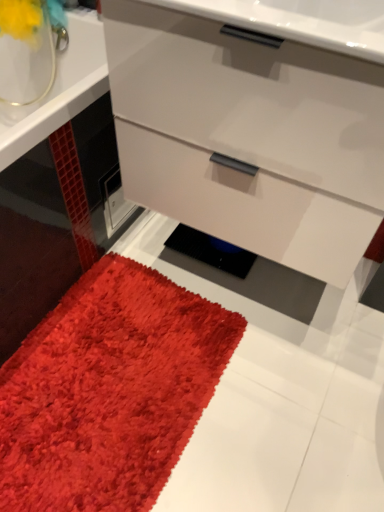
Question: Based on their sizes in the image, would you say matte white chest of drawers at center is bigger or smaller than matte yellow flower at upper left?

Choices:
 (A) small
 (B) big

Answer: (B)

Question: Would you say matte white chest of drawers at center is inside or outside matte yellow flower at upper left?

Choices:
 (A) inside
 (B) outside

Answer: (B)

Question: Which object is positioned farthest from the matte white chest of drawers at center?

Choices:
 (A) matte yellow flower at upper left
 (B) shaggy red carpet at lower left

Answer: (A)

Question: Estimate the real-world distances between objects in this image. Which object is farther from the matte yellow flower at upper left?

Choices:
 (A) shaggy red carpet at lower left
 (B) matte white chest of drawers at center

Answer: (A)